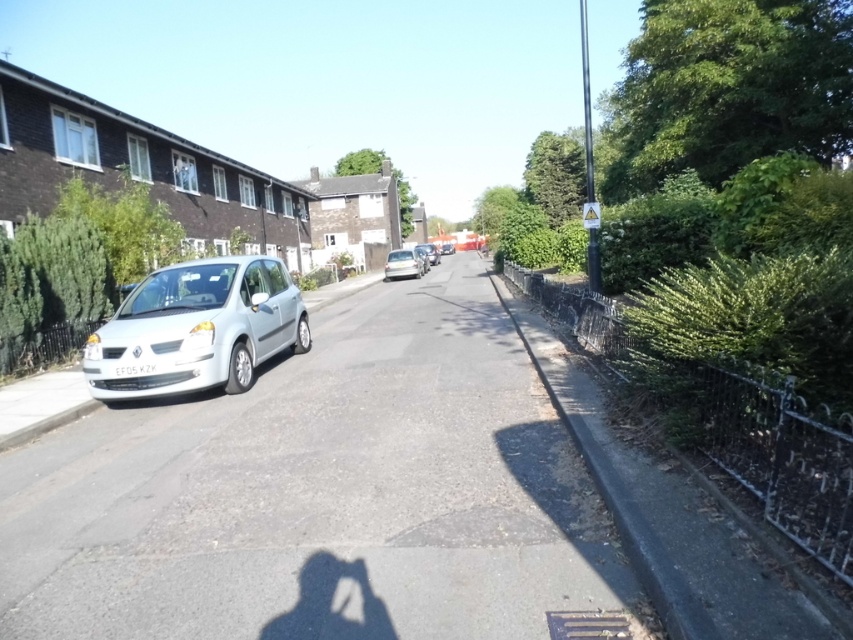
Does white matte car at left have a lesser width compared to silver metallic hatchback at center?

In fact, white matte car at left might be wider than silver metallic hatchback at center.

Who is positioned more to the left, white matte car at left or silver metallic hatchback at center?

white matte car at left

Is point (225, 312) closer to viewer compared to point (405, 260)?

That is True.

Where is `white matte car at left`? This screenshot has height=640, width=853. white matte car at left is located at coordinates (196, 330).